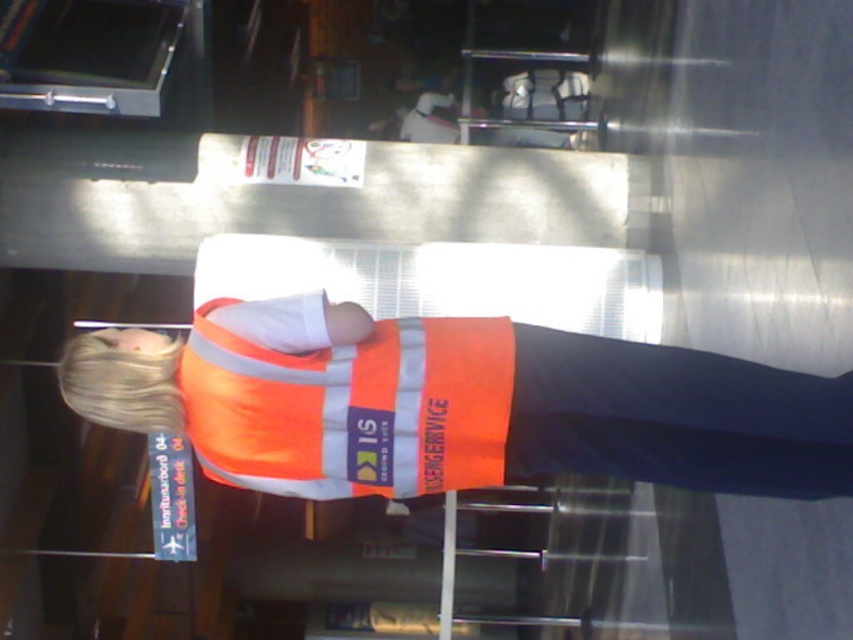
Question: Which point is closer to the camera taking this photo?

Choices:
 (A) (297, 394)
 (B) (257, 406)

Answer: (A)

Question: Which point is closer to the camera taking this photo?

Choices:
 (A) (209, 467)
 (B) (297, 401)

Answer: (B)

Question: Which object is farther from the camera taking this photo?

Choices:
 (A) reflective orange vest at center
 (B) orange reflective vest at center

Answer: (A)

Question: From the image, what is the correct spatial relationship of reflective orange vest at center in relation to orange reflective vest at center?

Choices:
 (A) left
 (B) right

Answer: (B)

Question: Does reflective orange vest at center have a smaller size compared to orange reflective vest at center?

Choices:
 (A) no
 (B) yes

Answer: (A)

Question: Does reflective orange vest at center appear over orange reflective vest at center?

Choices:
 (A) yes
 (B) no

Answer: (B)